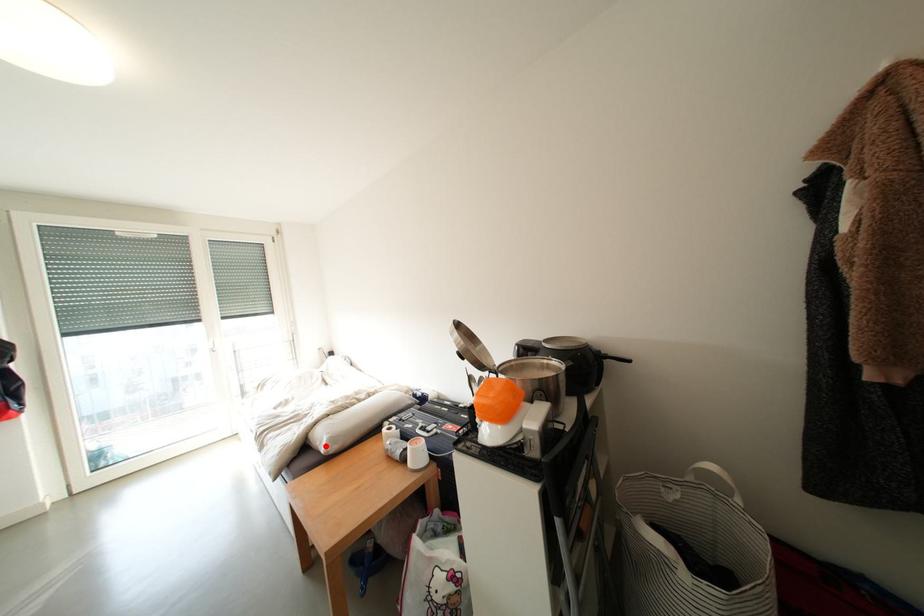
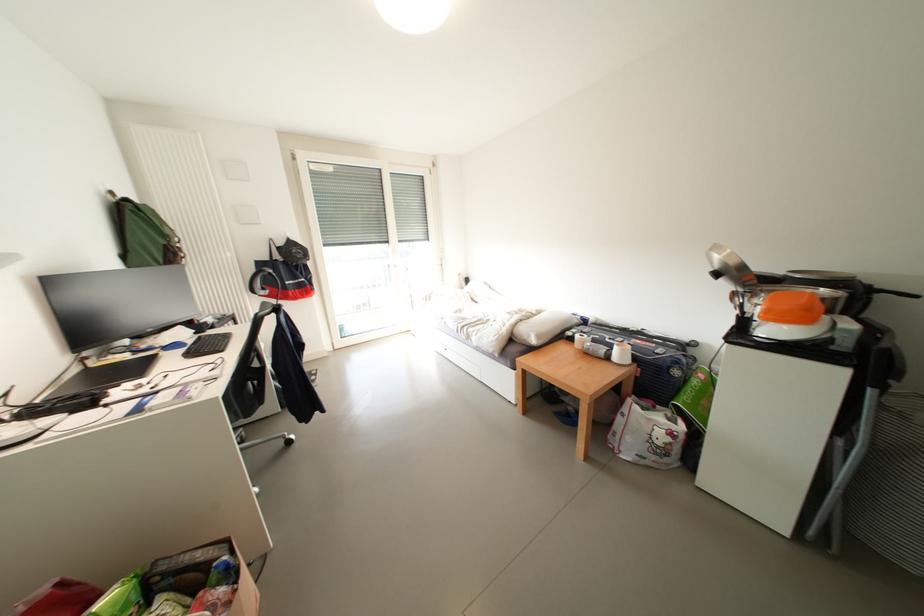
In the second image, find the point that corresponds to the highlighted location in the first image.

(532, 341)